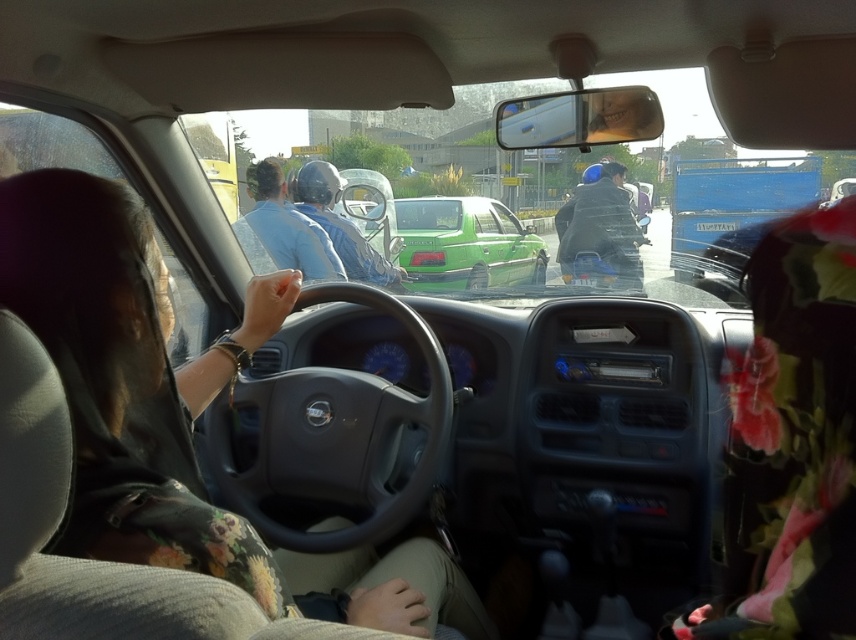
You are a delivery robot placed at the camera position in the car. You need to reach a delivery point located at point (263,561). What is the minimum distance you need to travel to reach the delivery point?

The minimum distance you need to travel to reach the delivery point at point (263,561) is 95.50 centimeters, as the straight line distance between the camera and the point is 95.50 centimeters.

You are sitting in the passenger seat of the car and notice two items at the center of the vehicle. Which item is positioned lower between the floral fabric dress at center and the blue matte helmet at center?

The floral fabric dress at center is positioned below the blue matte helmet at center, so it is the lower item.